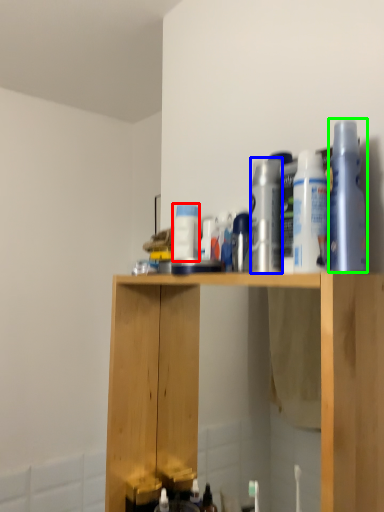
Question: Which object is positioned closest to cleaning product (highlighted by a red box)? Select from cleaning product (highlighted by a blue box) and cleaning product (highlighted by a green box).

Choices:
 (A) cleaning product
 (B) cleaning product

Answer: (A)